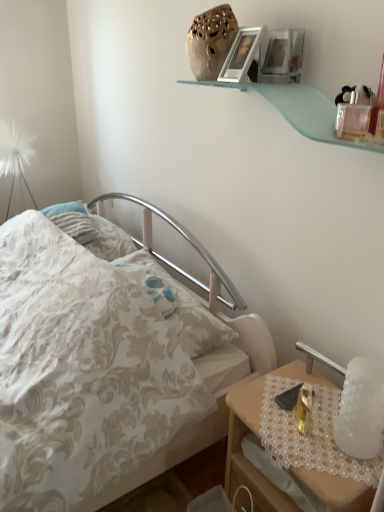
Question: From the image's perspective, is white floral fabric bed at center below matte silver picture frame at upper center?

Choices:
 (A) no
 (B) yes

Answer: (B)

Question: Does white floral fabric bed at center have a greater width compared to matte silver picture frame at upper center?

Choices:
 (A) yes
 (B) no

Answer: (A)

Question: Is white floral fabric bed at center bigger than matte silver picture frame at upper center?

Choices:
 (A) no
 (B) yes

Answer: (B)

Question: From a real-world perspective, is white floral fabric bed at center physically below matte silver picture frame at upper center?

Choices:
 (A) yes
 (B) no

Answer: (A)

Question: Can you confirm if white floral fabric bed at center is shorter than matte silver picture frame at upper center?

Choices:
 (A) yes
 (B) no

Answer: (B)

Question: From the image's perspective, is white floral fabric bed at center located above matte silver picture frame at upper center?

Choices:
 (A) no
 (B) yes

Answer: (A)

Question: Is wooden nightstand at lower right shorter than matte silver picture frame at upper center?

Choices:
 (A) yes
 (B) no

Answer: (B)

Question: Does wooden nightstand at lower right lie behind matte silver picture frame at upper center?

Choices:
 (A) no
 (B) yes

Answer: (A)

Question: Is wooden nightstand at lower right placed right next to matte silver picture frame at upper center?

Choices:
 (A) yes
 (B) no

Answer: (B)

Question: Does wooden nightstand at lower right have a greater width compared to matte silver picture frame at upper center?

Choices:
 (A) yes
 (B) no

Answer: (A)

Question: Does wooden nightstand at lower right have a larger size compared to matte silver picture frame at upper center?

Choices:
 (A) yes
 (B) no

Answer: (A)

Question: Is wooden nightstand at lower right positioned in front of matte silver picture frame at upper center?

Choices:
 (A) no
 (B) yes

Answer: (B)

Question: Is white floral fabric bed at center to the right of wooden nightstand at lower right from the viewer's perspective?

Choices:
 (A) no
 (B) yes

Answer: (A)